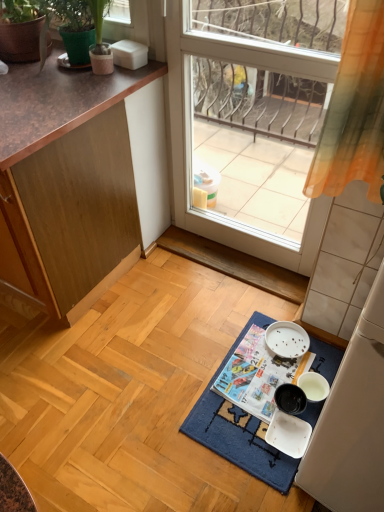
Image resolution: width=384 pixels, height=512 pixels. Identify the location of vacant space underneath transparent glass door at center (from a real-world perspective). (245, 254).